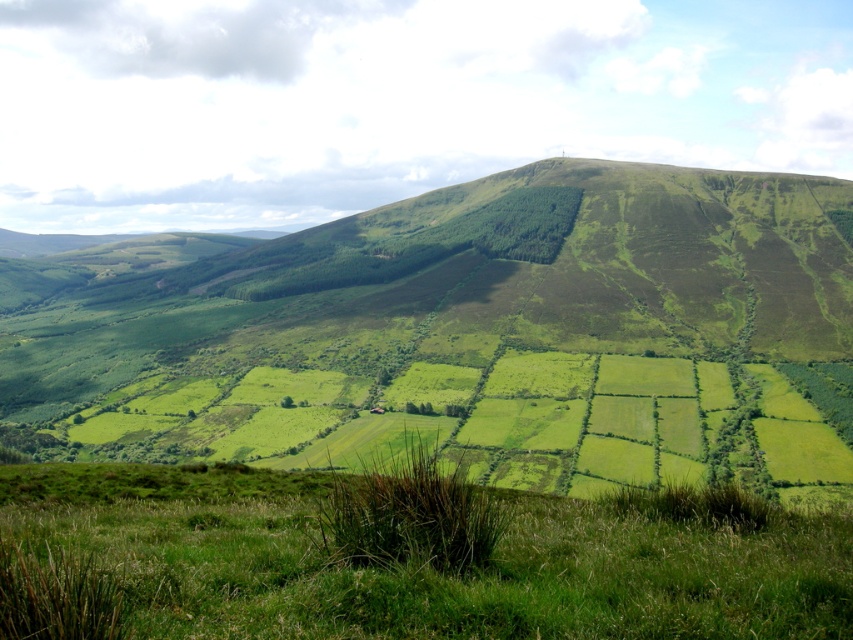
Based on the photo, you are standing at the base of the green grassy at lower center and want to climb to the top of the green grassy hill at center. Which path would require more effort?

The green grassy hill at center is taller than the green grassy at lower center, so climbing to the top of the green grassy hill at center would require more effort.

You are standing at the point labeled as point (13,525) in the image. Looking towards the large hill in the background, can you see the point labeled point (471,369)? Explain why or why not based on the landscape details.

Yes, you can see the point labeled point (471,369) because it is behind point (13,525), which means it is further away in the same line of sight. Since there are no obstructions mentioned like hedgerows or fields blocking the view between them, the point should be visible.

You are standing at the center of the image and want to walk towards the green grassy hill at center. Which direction should you head?

Since the green grassy hill at center is already at the center of the image, you are already facing it. Just walk straight ahead.